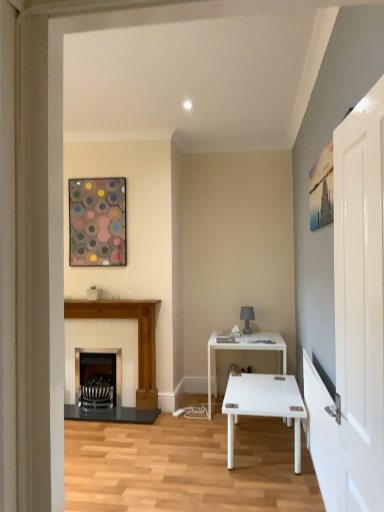
Locate an element on the screen. The height and width of the screenshot is (512, 384). metallic hexagonal artwork at upper left is located at coordinates (97, 222).

Describe the element at coordinates (360, 301) in the screenshot. I see `white glossy door at right` at that location.

What do you see at coordinates (246, 349) in the screenshot?
I see `white glossy table at center` at bounding box center [246, 349].

Where is `black metal fireplace at center, acting as the 1th fireplace starting from the left`? The image size is (384, 512). black metal fireplace at center, acting as the 1th fireplace starting from the left is located at coordinates (98, 371).

Identify the location of matte gray lamp at center. The width and height of the screenshot is (384, 512). (247, 318).

From a real-world perspective, is wooden fireplace at left, placed as the second fireplace when sorted from left to right, physically located above or below white glossy door at right?

Clearly, from a real-world perspective, wooden fireplace at left, placed as the second fireplace when sorted from left to right, is below white glossy door at right.

From the image's perspective, between wooden fireplace at left, the first fireplace when ordered from right to left, and white glossy door at right, who is located below?

A: wooden fireplace at left, the first fireplace when ordered from right to left, appears lower in the image.

Can you confirm if wooden fireplace at left, the first fireplace when ordered from right to left, is smaller than white glossy door at right?

Actually, wooden fireplace at left, the first fireplace when ordered from right to left, might be larger than white glossy door at right.

Is metallic hexagonal artwork at upper left positioned far away from wooden fireplace at left, the first fireplace when ordered from right to left?

Actually, metallic hexagonal artwork at upper left and wooden fireplace at left, the first fireplace when ordered from right to left, are a little close together.

This screenshot has width=384, height=512. In order to click on picture frame that appears above the wooden fireplace at left, the first fireplace when ordered from right to left (from the image's perspective) in this screenshot , I will do `click(97, 222)`.

Is metallic hexagonal artwork at upper left to the left of wooden fireplace at left, the first fireplace when ordered from right to left, from the viewer's perspective?

A: Correct, you'll find metallic hexagonal artwork at upper left to the left of wooden fireplace at left, the first fireplace when ordered from right to left.

Based on the photo, from a real-world perspective, between metallic hexagonal artwork at upper left and wooden fireplace at left, placed as the second fireplace when sorted from left to right, who is vertically lower?

wooden fireplace at left, placed as the second fireplace when sorted from left to right.

Considering the relative sizes of white glossy door at right and wooden fireplace at left, the first fireplace when ordered from right to left, in the image provided, is white glossy door at right thinner than wooden fireplace at left, the first fireplace when ordered from right to left,?

Indeed, white glossy door at right has a lesser width compared to wooden fireplace at left, the first fireplace when ordered from right to left.

Considering the sizes of objects white glossy door at right and wooden fireplace at left, placed as the second fireplace when sorted from left to right, in the image provided, who is bigger, white glossy door at right or wooden fireplace at left, placed as the second fireplace when sorted from left to right,?

Bigger between the two is wooden fireplace at left, placed as the second fireplace when sorted from left to right.

Is white glossy door at right positioned with its back to wooden fireplace at left, the first fireplace when ordered from right to left?

That's not correct — white glossy door at right is not looking away from wooden fireplace at left, the first fireplace when ordered from right to left.

You are a GUI agent. You are given a task and a screenshot of the screen. Output one action in this format:
    pyautogui.click(x=<x>, y=<y>)
    Task: Click on the fireplace behind the wooden fireplace at left, placed as the second fireplace when sorted from left to right
    The width and height of the screenshot is (384, 512).
    Given the screenshot: What is the action you would take?
    pyautogui.click(x=98, y=371)

From the image's perspective, which is below, black metal fireplace at center, the 2th fireplace in the right-to-left sequence, or wooden fireplace at left, the first fireplace when ordered from right to left?

From the image's view, black metal fireplace at center, the 2th fireplace in the right-to-left sequence, is below.

Considering the relative sizes of black metal fireplace at center, the 2th fireplace in the right-to-left sequence, and wooden fireplace at left, placed as the second fireplace when sorted from left to right, in the image provided, is black metal fireplace at center, the 2th fireplace in the right-to-left sequence, bigger than wooden fireplace at left, placed as the second fireplace when sorted from left to right,?

No.

Considering the relative positions of matte gray lamp at center and white glossy table at center in the image provided, is matte gray lamp at center behind white glossy table at center?

That is True.

Choose the correct answer: Is matte gray lamp at center inside white glossy table at center or outside it?

The correct answer is: outside.

From a real-world perspective, is matte gray lamp at center over white glossy table at center?

Yes, from a real-world perspective, matte gray lamp at center is on top of white glossy table at center.

Can you confirm if matte gray lamp at center is positioned to the left of white glossy table at center?

In fact, matte gray lamp at center is to the right of white glossy table at center.

Is matte gray lamp at center smaller than metallic hexagonal artwork at upper left?

Yes, matte gray lamp at center is smaller than metallic hexagonal artwork at upper left.

Could you tell me if matte gray lamp at center is turned towards metallic hexagonal artwork at upper left?

No, matte gray lamp at center does not turn towards metallic hexagonal artwork at upper left.

Consider the image. Considering the sizes of matte gray lamp at center and metallic hexagonal artwork at upper left in the image, is matte gray lamp at center taller or shorter than metallic hexagonal artwork at upper left?

Considering their sizes, matte gray lamp at center has less height than metallic hexagonal artwork at upper left.

From the image's perspective, is matte gray lamp at center beneath metallic hexagonal artwork at upper left?

Yes.

From the picture: From the image's perspective, which one is positioned higher, matte gray lamp at center or white glossy door at right?

white glossy door at right, from the image's perspective.

Looking at this image, does matte gray lamp at center appear on the left side of white glossy door at right?

Incorrect, matte gray lamp at center is not on the left side of white glossy door at right.

Does matte gray lamp at center have a smaller size compared to white glossy door at right?

Indeed, matte gray lamp at center has a smaller size compared to white glossy door at right.

Does point (253, 312) appear closer or farther from the camera than point (367, 149)?

Point (253, 312) appears to be farther away from the viewer than point (367, 149).

This screenshot has height=512, width=384. I want to click on fireplace that is the 1st object directly below the white glossy door at right (from a real-world perspective), so click(138, 337).

You are a GUI agent. You are given a task and a screenshot of the screen. Output one action in this format:
    pyautogui.click(x=<x>, y=<y>)
    Task: Click on the picture frame above the wooden fireplace at left, the first fireplace when ordered from right to left (from the image's perspective)
    The width and height of the screenshot is (384, 512).
    Given the screenshot: What is the action you would take?
    pyautogui.click(x=97, y=222)

Looking at the image, which one is located closer to black metal fireplace at center, the 2th fireplace in the right-to-left sequence, white glossy table at center or white glossy door at right?

white glossy table at center lies closer to black metal fireplace at center, the 2th fireplace in the right-to-left sequence, than the other object.

Consider the image. When comparing their distances from matte gray lamp at center, does white glossy table at center or metallic hexagonal artwork at upper left seem closer?

Among the two, white glossy table at center is located nearer to matte gray lamp at center.

Based on their spatial positions, is white glossy table at center or black metal fireplace at center, the 2th fireplace in the right-to-left sequence, further from wooden fireplace at left, placed as the second fireplace when sorted from left to right?

The object further to wooden fireplace at left, placed as the second fireplace when sorted from left to right, is white glossy table at center.

Based on their spatial positions, is white glossy door at right or metallic hexagonal artwork at upper left further from matte gray lamp at center?

white glossy door at right is further to matte gray lamp at center.

Based on their spatial positions, is black metal fireplace at center, acting as the 1th fireplace starting from the left, or white glossy table at center further from wooden fireplace at left, placed as the second fireplace when sorted from left to right?

Based on the image, white glossy table at center appears to be further to wooden fireplace at left, placed as the second fireplace when sorted from left to right.

From the image, which object appears to be farther from matte gray lamp at center, white glossy door at right or white glossy table at center?

white glossy door at right is further to matte gray lamp at center.

Estimate the real-world distances between objects in this image. Which object is further from white glossy door at right, metallic hexagonal artwork at upper left or matte gray lamp at center?

matte gray lamp at center is further to white glossy door at right.

Which object lies further to the anchor point white glossy door at right, white glossy table at center or matte gray lamp at center?

Based on the image, matte gray lamp at center appears to be further to white glossy door at right.

Where is `fireplace between black metal fireplace at center, the 2th fireplace in the right-to-left sequence, and white glossy table at center`? fireplace between black metal fireplace at center, the 2th fireplace in the right-to-left sequence, and white glossy table at center is located at coordinates (138, 337).

Locate an element on the screen. picture frame between white glossy door at right and black metal fireplace at center, the 2th fireplace in the right-to-left sequence, along the z-axis is located at coordinates tap(97, 222).

Where is `table between metallic hexagonal artwork at upper left and black metal fireplace at center, the 2th fireplace in the right-to-left sequence, in the up-down direction`? table between metallic hexagonal artwork at upper left and black metal fireplace at center, the 2th fireplace in the right-to-left sequence, in the up-down direction is located at coordinates (246, 349).

At what (x,y) coordinates should I click in order to perform the action: click on fireplace located between white glossy door at right and metallic hexagonal artwork at upper left in the depth direction. Please return your answer as a coordinate pair (x, y). Looking at the image, I should click on (138, 337).